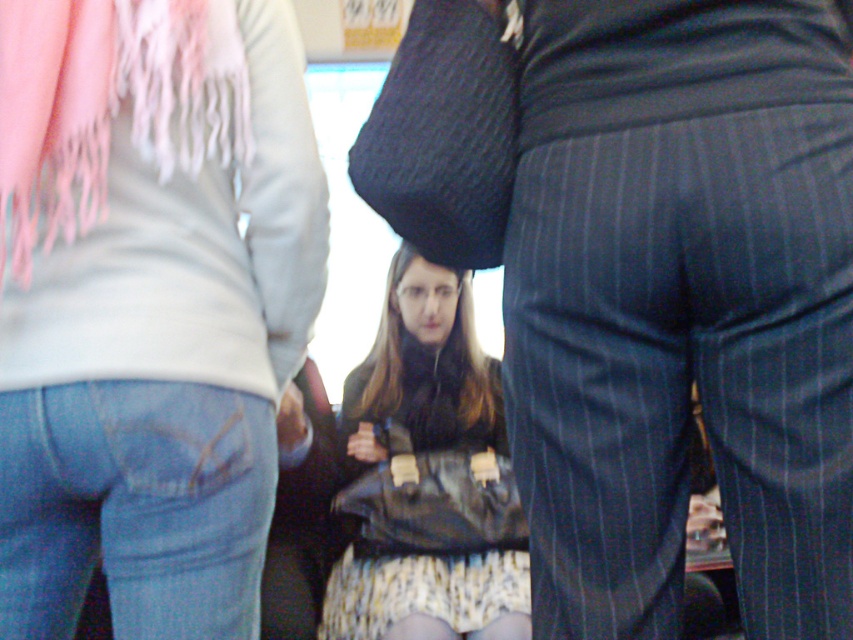
From the picture: You are at a social gathering and want to grab your leather bag at center without moving from your current position. Is the pink fringed scarf at upper left blocking your path to the bag?

The pink fringed scarf at upper left is to the left of the leather bag at center, so it is not blocking the path to the bag since it is positioned to the side.

In the image, there is a pink fringed scarf at upper left. Can you tell me the exact 2D coordinates of this scarf?

The pink fringed scarf at upper left is located at the 2D coordinates of point (108, 104).